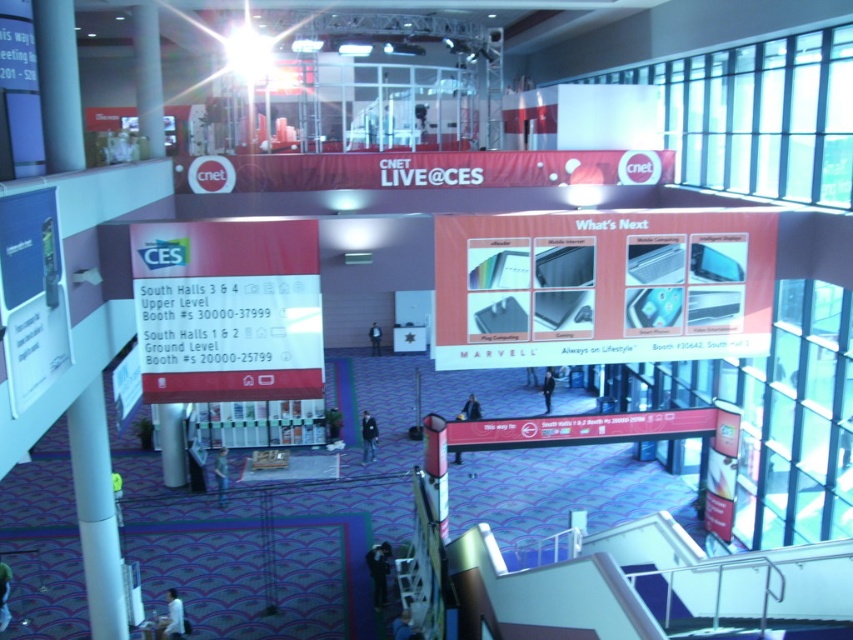
Is point (218, 499) positioned in front of point (543, 390)?

Yes, point (218, 499) is closer to viewer.

Can you confirm if dark blue shirt at center is shorter than dark blue suit at center?

Yes, dark blue shirt at center is shorter than dark blue suit at center.

Is point (216, 467) positioned in front of point (544, 403)?

Yes, point (216, 467) is in front of point (544, 403).

This screenshot has height=640, width=853. I want to click on dark blue shirt at center, so click(x=221, y=474).

Between point (260, 288) and point (367, 416), which one is positioned in front?

Point (260, 288) is in front.

This screenshot has width=853, height=640. I want to click on matte red sign at center, so click(x=227, y=308).

Is black fabric at lower center bigger than blue fabric jacket at lower center?

Indeed, black fabric at lower center has a larger size compared to blue fabric jacket at lower center.

I want to click on black fabric at lower center, so click(378, 572).

Where is `black fabric at lower center`? The width and height of the screenshot is (853, 640). black fabric at lower center is located at coordinates (378, 572).